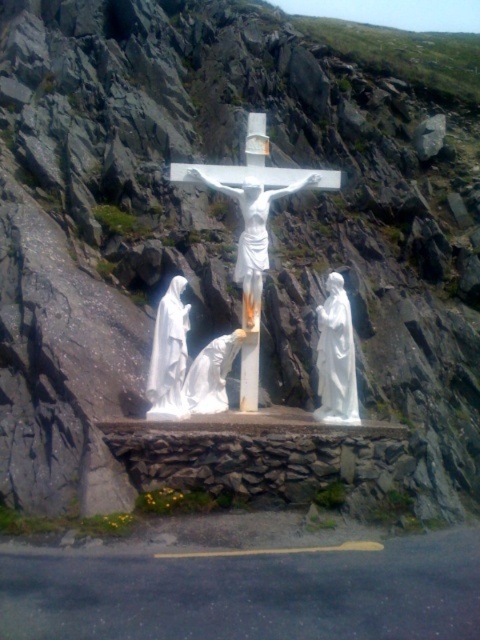
You are an art conservator assessing the stability of the sculptures. The white marble crucifix at center and the white marble statue at left are both on the same base. Which one is placed higher up?

The white marble crucifix at center is positioned over the white marble statue at left, so it is placed higher up.

Based on the scene description, which object is taller between the white marble crucifix at center and the white glossy statue at center?

The white marble crucifix at center is much taller than the white glossy statue at center.

You are standing in front of the religious sculpture and want to determine which of the two points, point (351, 384) or point (177, 339), is closer to you. Based on the sculpture, which point is nearer?

Point (351, 384) is closer to you because it is further to the viewer than point (177, 339).